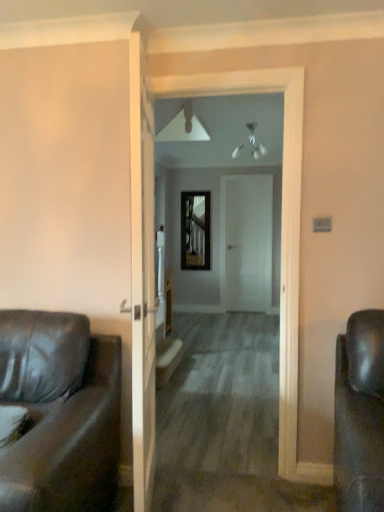
Question: Does point (238, 306) appear closer or farther from the camera than point (289, 199)?

Choices:
 (A) farther
 (B) closer

Answer: (A)

Question: Based on their positions, is white matte door at center located to the left or right of smooth wooden floor at center?

Choices:
 (A) right
 (B) left

Answer: (A)

Question: Estimate the real-world distances between objects in this image. Which object is farther from the wooden at center?

Choices:
 (A) smooth wooden floor at center
 (B) metallic reflective mirror at center
 (C) matte black leather couch at left
 (D) white matte door at center

Answer: (B)

Question: Based on their relative distances, which object is farther from the smooth wooden floor at center?

Choices:
 (A) wooden at center
 (B) metallic reflective mirror at center
 (C) white matte door at center
 (D) matte black leather couch at left

Answer: (B)